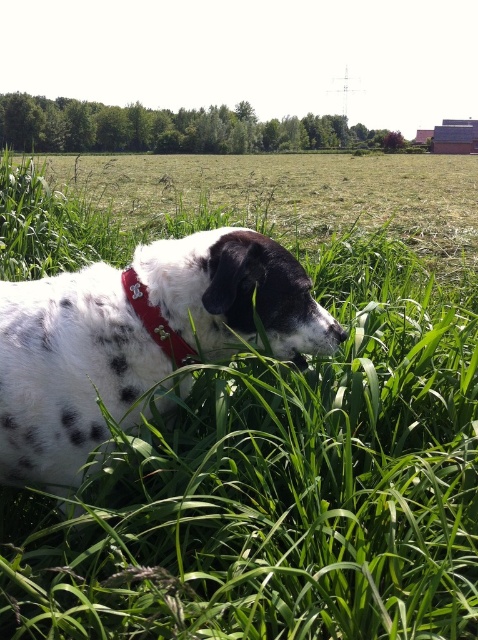
You are a photographer trying to capture a closeup of the red fabric neckband at center. However, the spotted fur dog at lower left is blocking your view. Can you estimate if the dog is wider than the neckband?

The spotted fur dog at lower left might be wider than red fabric neckband at center, so there is a possibility that the dog is blocking the neckband completely.

You are standing in a grassy field and see two points marked in the scene. The first point is at coordinate point (x=28, y=296) and the second point is at point (x=127, y=273). Which point is closer to you?

Point (x=28, y=296) is closer to the viewer than point (x=127, y=273) according to the scene description.